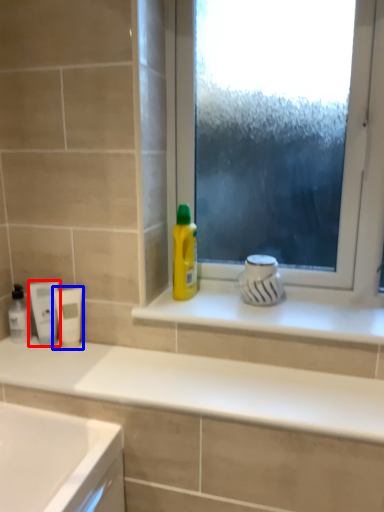
Question: Which object appears farthest to the camera in this image, mouthwash (highlighted by a red box) or mouthwash (highlighted by a blue box)?

Choices:
 (A) mouthwash
 (B) mouthwash

Answer: (A)